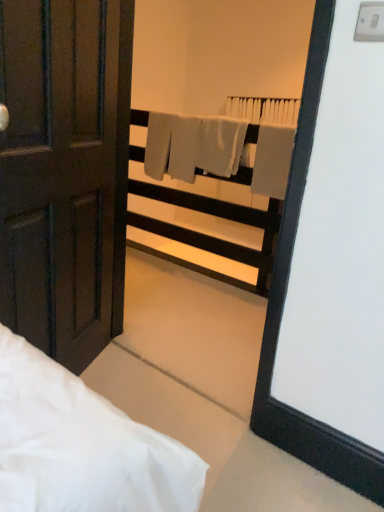
Identify the location of vacant area in front of white plastic balustrade at upper center. (197, 301).